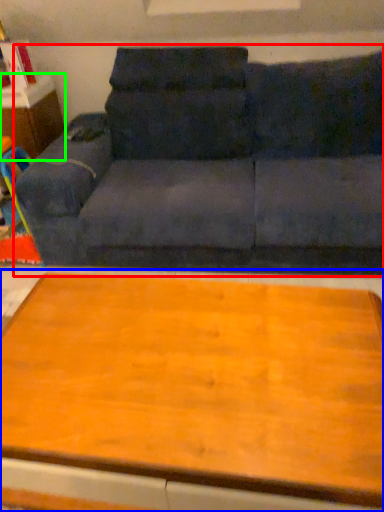
Question: Which is farther away from studio couch (highlighted by a red box)? table (highlighted by a blue box) or dresser (highlighted by a green box)?

Choices:
 (A) table
 (B) dresser

Answer: (A)